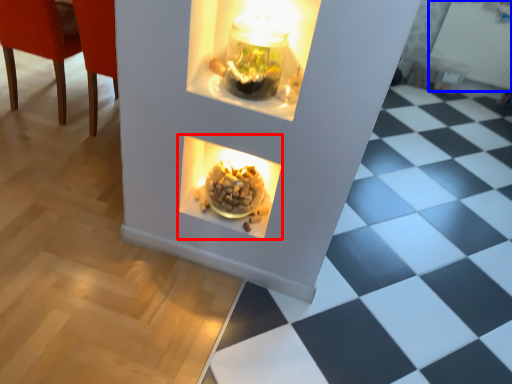
Question: Among these objects, which one is nearest to the camera, fireplace (highlighted by a red box) or radiator (highlighted by a blue box)?

Choices:
 (A) fireplace
 (B) radiator

Answer: (A)